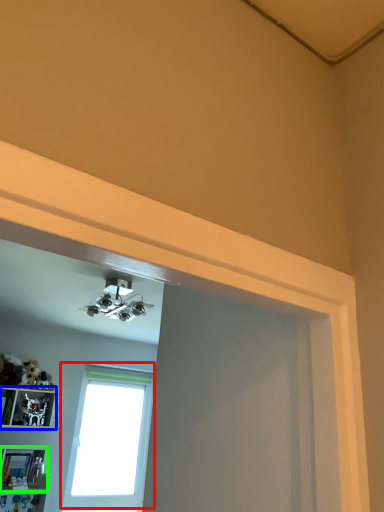
Question: Estimate the real-world distances between objects in this image. Which object is closer to window (highlighted by a red box), shelf (highlighted by a blue box) or shelf (highlighted by a green box)?

Choices:
 (A) shelf
 (B) shelf

Answer: (A)